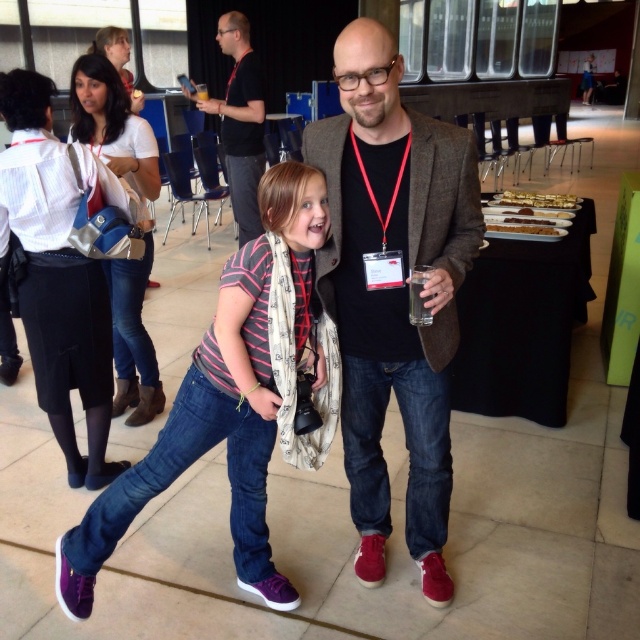
Is point (476, 196) positioned after point (132, 476)?

No, (476, 196) is closer to viewer.

Is point (438, 204) closer to viewer compared to point (70, 538)?

Yes.

Does point (349, 406) come farther from viewer compared to point (241, 339)?

Yes.

Locate an element on the screen. This screenshot has height=640, width=640. brown woolen jacket at center is located at coordinates (394, 291).

Measure the distance between purple suede shoes at lower left and denim jeans at left.

They are 1.20 meters apart.

Which of these two, purple suede shoes at lower left or denim jeans at left, stands taller?

Standing taller between the two is denim jeans at left.

Who is more distant from viewer, (161,484) or (120,147)?

Positioned behind is point (120,147).

Where is `purple suede shoes at lower left`? purple suede shoes at lower left is located at coordinates (202, 444).

Does brown woolen jacket at center have a lesser height compared to black cotton shirt at upper center?

No, brown woolen jacket at center is not shorter than black cotton shirt at upper center.

Is point (428, 384) behind point (241, 83)?

No, (428, 384) is in front of (241, 83).

Who is more forward, [392,198] or [252,92]?

Point [392,198] is in front.

Identify the location of brown woolen jacket at center. tap(394, 291).